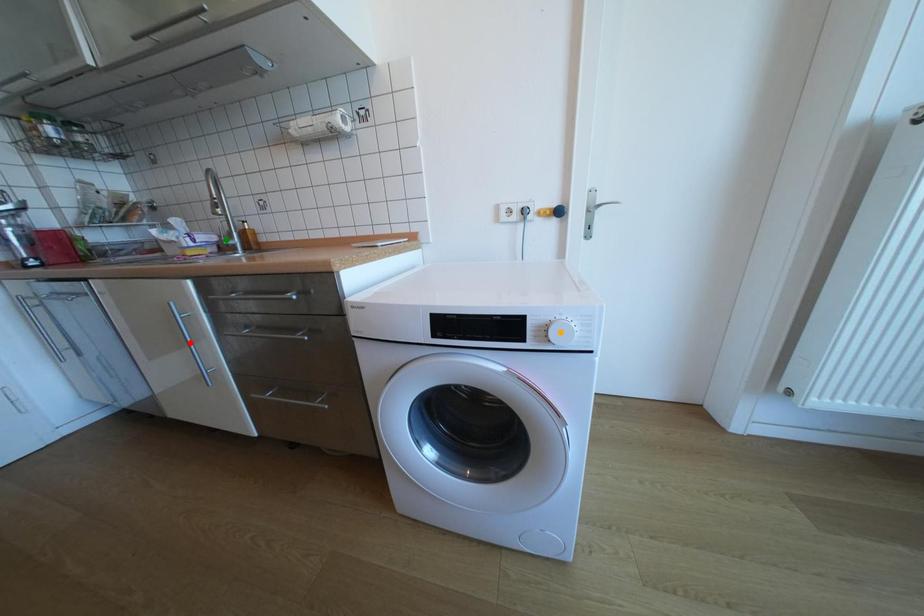
Order these from farthest to nearest:
A) orange point
B) green point
C) red point

green point → red point → orange point